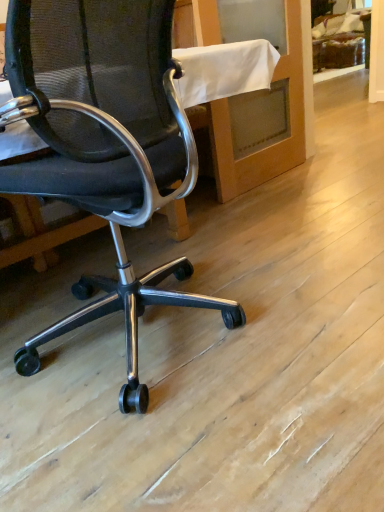
Locate an element on the screen. The height and width of the screenshot is (512, 384). vacant region under matte black office chair at left (from a real-world perspective) is located at coordinates (166, 344).